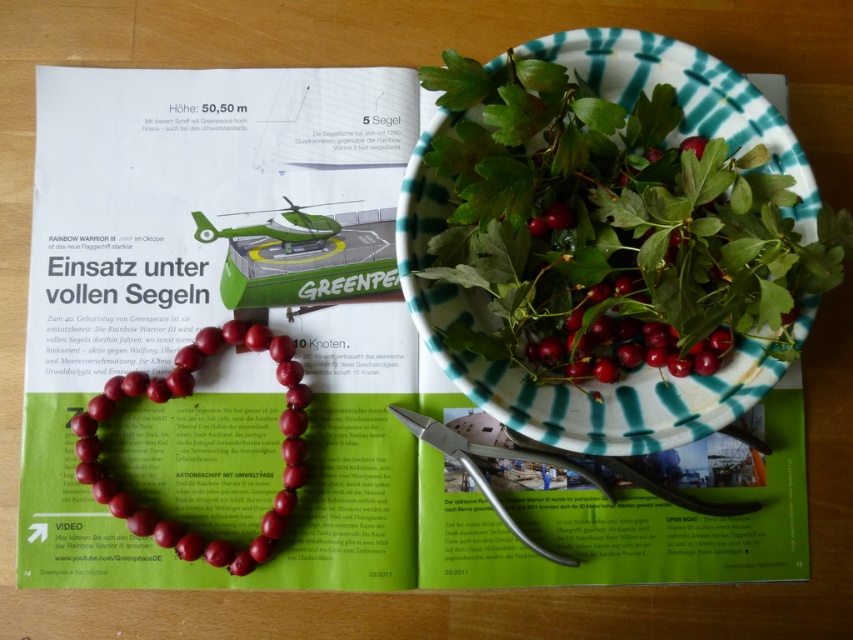
You are organizing a craft project and need to know the spatial arrangement of the items on the wooden surface. Which object is closer to you between the shiny red beads at center and the metallic silver scissors at center?

The shiny red beads at center are closer to you because they are positioned in front of the metallic silver scissors at center.

You are organizing a craft project and need to know the spatial arrangement of items on the wooden surface. Are the shiny red berries at center located above or below the metallic silver scissors at center?

The shiny red berries at center is above the metallic silver scissors at center according to the description.